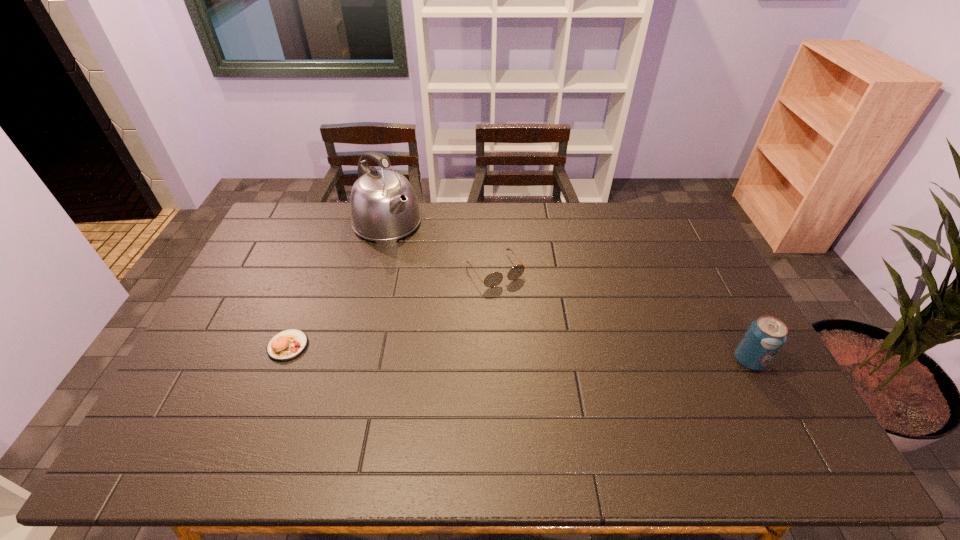
Identify the location of free spot between the leftmost object and the third object from left to right. Image resolution: width=960 pixels, height=540 pixels. (392, 308).

The width and height of the screenshot is (960, 540). I want to click on vacant point located between the leftmost object and the second farthest object, so click(392, 308).

You are a GUI agent. You are given a task and a screenshot of the screen. Output one action in this format:
    pyautogui.click(x=<x>, y=<y>)
    Task: Click on the free space between the pop soda and the tallest object
    
    Given the screenshot: What is the action you would take?
    pyautogui.click(x=568, y=292)

Identify which object is the third nearest to the shortest object. Please provide its 2D coordinates. Your answer should be formatted as a tuple, i.e. [(x, y)], where the tuple contains the x and y coordinates of a point satisfying the conditions above.

[(765, 336)]

Identify the location of object that stands as the closest to the rightmost object. (493, 279).

Identify the location of free location that satisfies the following two spatial constraints: 1. on the front side of the second farthest object; 2. on the left side of the third shortest object. (x=498, y=361).

This screenshot has height=540, width=960. In order to click on vacant region that satisfies the following two spatial constraints: 1. on the front side of the tallest object; 2. on the right side of the third shortest object in this screenshot , I will do `click(352, 361)`.